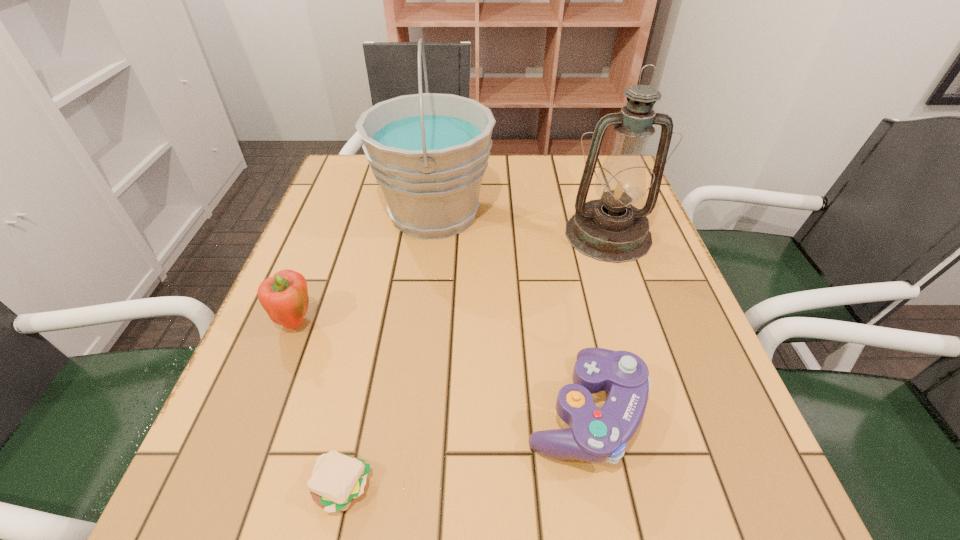
The image size is (960, 540). I want to click on vacant space located on the right of the patty, so click(x=433, y=488).

Image resolution: width=960 pixels, height=540 pixels. I want to click on object at the far edge, so click(428, 152).

The width and height of the screenshot is (960, 540). Identify the location of control at the near edge. (595, 435).

Find the location of `patty that is at the near edge`. patty that is at the near edge is located at coordinates (337, 479).

What are the coordinates of `bucket that is at the left edge` in the screenshot? It's located at (x=428, y=152).

Where is `pepper located at the left edge`? This screenshot has height=540, width=960. pepper located at the left edge is located at coordinates (284, 297).

The height and width of the screenshot is (540, 960). Find the location of `oil lamp located at the right edge`. oil lamp located at the right edge is located at coordinates (610, 229).

Find the location of a particular element. This screenshot has width=960, height=540. control at the right edge is located at coordinates (595, 435).

Image resolution: width=960 pixels, height=540 pixels. Identify the location of object that is at the far left corner. (428, 152).

Find the location of `object positioned at the near right corner`. object positioned at the near right corner is located at coordinates (595, 435).